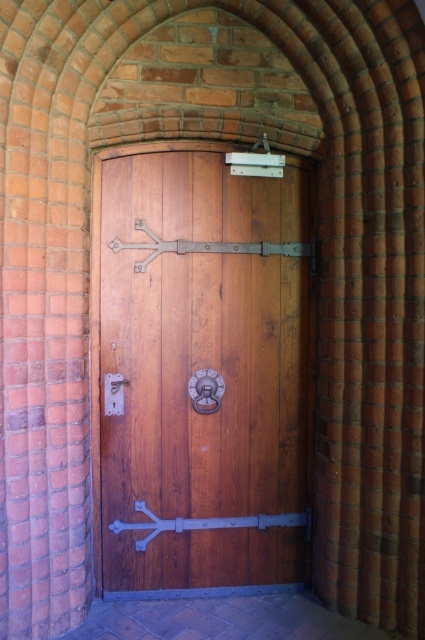
You are a delivery person trying to deliver a package to the address shown in the image. You see the wooden door at center and the matte silver lock at center. Which object should you interact with first to gain access?

The wooden door at center is in front of matte silver lock at center, so you should interact with the wooden door at center first to gain access.

You are a delivery person trying to deliver a package to the house. You see the wooden door at center and the matte silver lock at center. Which object is closer to you?

The wooden door at center is positioned over the matte silver lock at center, so the wooden door at center is closer to you.

You are standing in front of the wooden door at center. You need to reach the door handle located at its center to open it. Considering your height is 1.7 meters, can you comfortably reach the handle without needing a stool?

The wooden door at center is 2.11 meters away from you. Since the distance is horizontal, your height of 1.7 meters does not affect your ability to reach the handle. You can comfortably reach the handle without needing a stool.